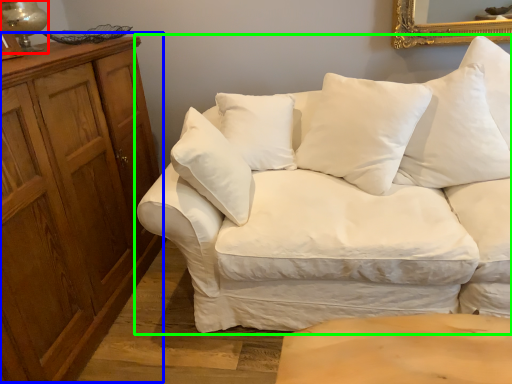
Question: Which object is the farthest from table lamp (highlighted by a red box)? Choose among these: dresser (highlighted by a blue box) or studio couch (highlighted by a green box).

Choices:
 (A) dresser
 (B) studio couch

Answer: (B)